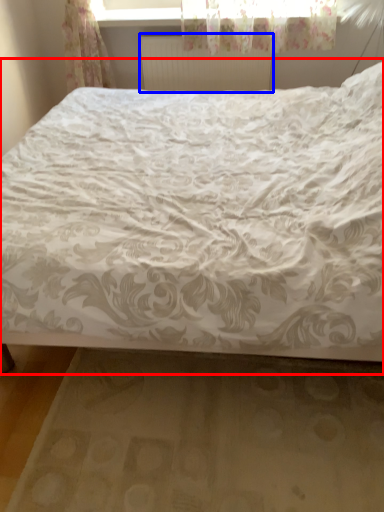
Question: Which of the following is the closest to the observer, bed (highlighted by a red box) or radiator (highlighted by a blue box)?

Choices:
 (A) bed
 (B) radiator

Answer: (A)